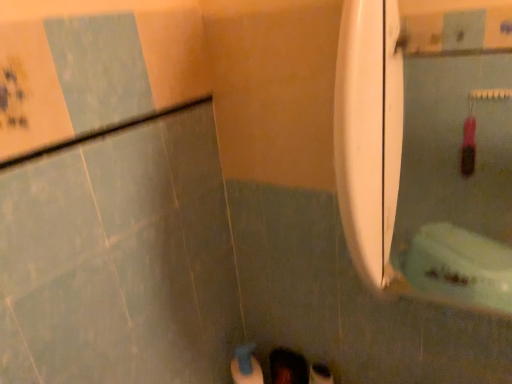
Measure the distance between matte black shoe at lower center and camera.

They are 35.98 inches apart.

What do you see at coordinates (288, 367) in the screenshot?
I see `matte black shoe at lower center` at bounding box center [288, 367].

In order to face matte black shoe at lower center, should I rotate leftwards or rightwards?

Turn right by 4.852 degrees to look at matte black shoe at lower center.

You are a GUI agent. You are given a task and a screenshot of the screen. Output one action in this format:
    pyautogui.click(x=<x>, y=<y>)
    Task: Click on the matte black shoe at lower center
    This screenshot has height=384, width=512.
    Given the screenshot: What is the action you would take?
    (x=288, y=367)

Image resolution: width=512 pixels, height=384 pixels. Identify the location of matte black shoe at lower center. (288, 367).